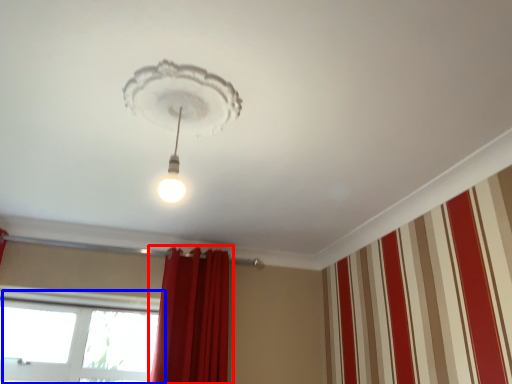
Question: Which point is closer to the camera, curtain (highlighted by a red box) or window (highlighted by a blue box)?

Choices:
 (A) curtain
 (B) window

Answer: (A)